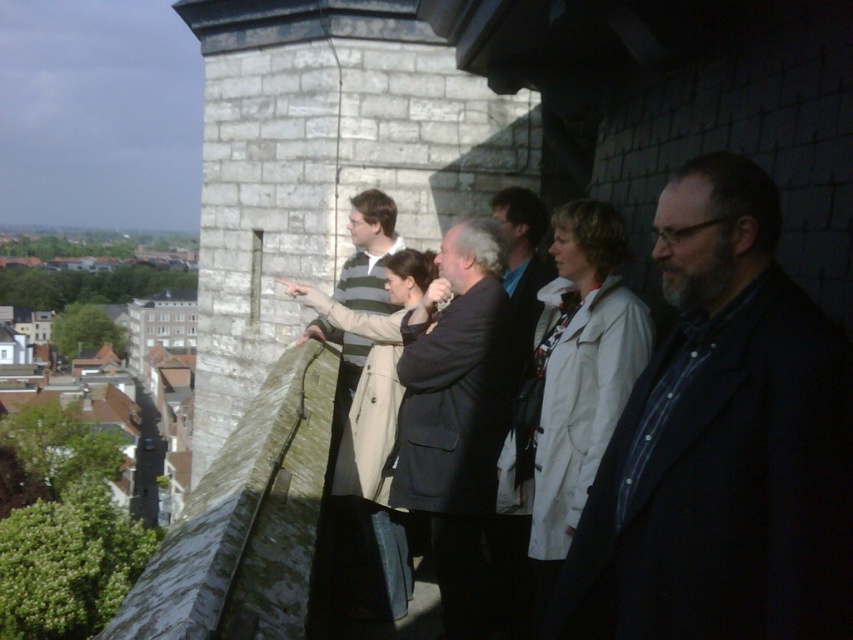
You are part of the group standing on the stone structure. You notice two people wearing a dark blue shirt at center and a striped knit sweater at center. Which person is positioned to the right?

The dark blue shirt at center is positioned to the right of the striped knit sweater at center.

You are standing on the edge of the stone structure in the image. There is a point marked at coordinates (722, 444). What object or person is located at that point?

The point at coordinates (722, 444) marks the location of the dark blue shirt at center.